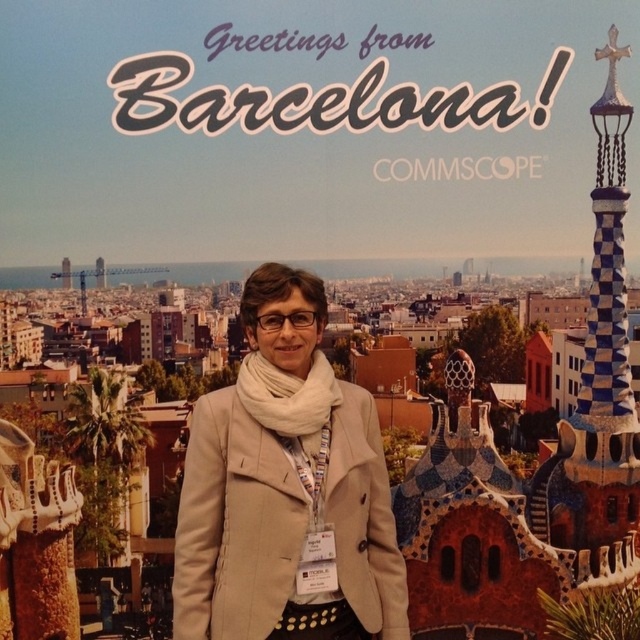
Between beige wool coat at center and blue and white checkered tower at right, which one is positioned higher?

blue and white checkered tower at right is higher up.

Who is taller, beige wool coat at center or blue and white checkered tower at right?

blue and white checkered tower at right is taller.

Between point (208, 400) and point (621, 326), which one is positioned in front?

Point (208, 400) is more forward.

I want to click on beige wool coat at center, so click(x=285, y=486).